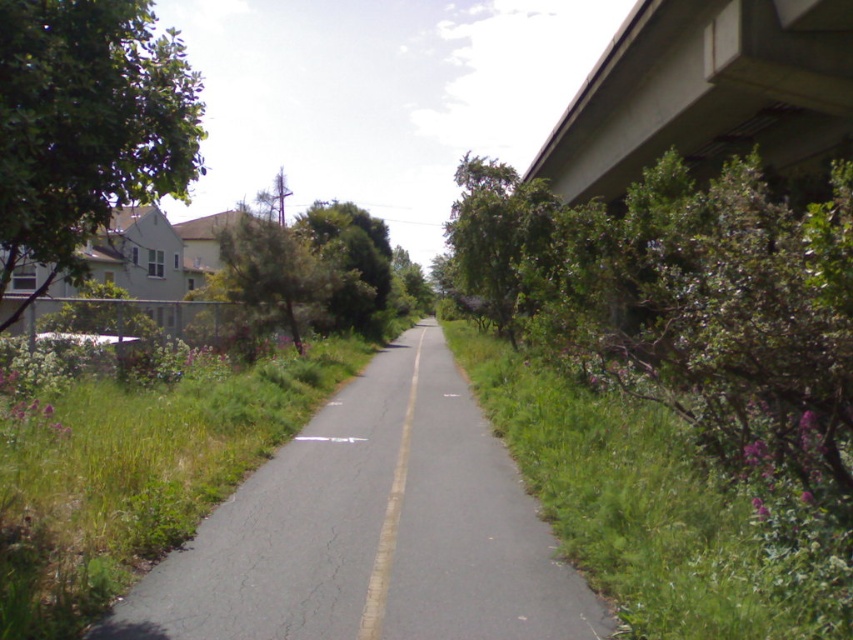
You are driving a car and need to park near the green leafy bush at right and the green grass at lower left. Which object is closer to the road?

The green grass at lower left is closer to the road because it is positioned lower than the green leafy bush at right, which is located above it.

You are a delivery driver planning to make a U turn on the road. The length of your truck is 12 meters. Considering the green leafy bush at right and the green leafy tree at left, is there enough space between them for your truck to complete the U turn without hitting either?

The distance between the green leafy bush at right and the green leafy tree at left is 14.62 meters. Since your truck is 12 meters long, there is sufficient space to make the U turn without hitting either obstacle.

You are a pedestrian standing on the narrow paved road and want to cross to the residential area behind the chain link fence on the left. The green leafy bush at right and the green grass at lower left are in your path. Which object is closer to you as you plan your crossing route?

The green leafy bush at right is closer to you than the green grass at lower left because it is further to the viewer.